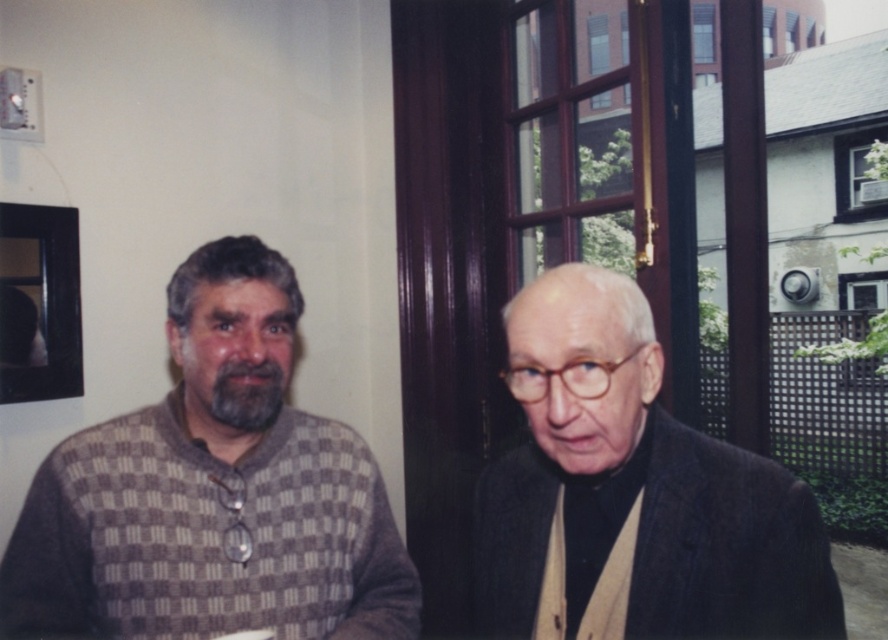
Looking at this image, can you confirm if checkered sweater at left is positioned below dark gray wool suit at right?

Indeed, checkered sweater at left is positioned under dark gray wool suit at right.

Which of these two, checkered sweater at left or dark gray wool suit at right, stands taller?

checkered sweater at left is taller.

Describe the element at coordinates (213, 492) in the screenshot. I see `checkered sweater at left` at that location.

This screenshot has width=888, height=640. Identify the location of checkered sweater at left. (213, 492).